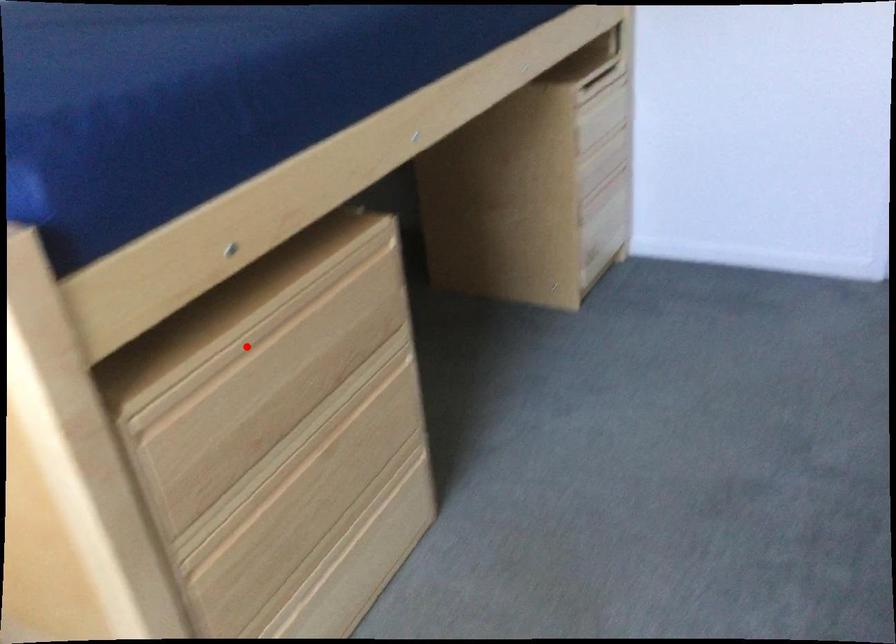
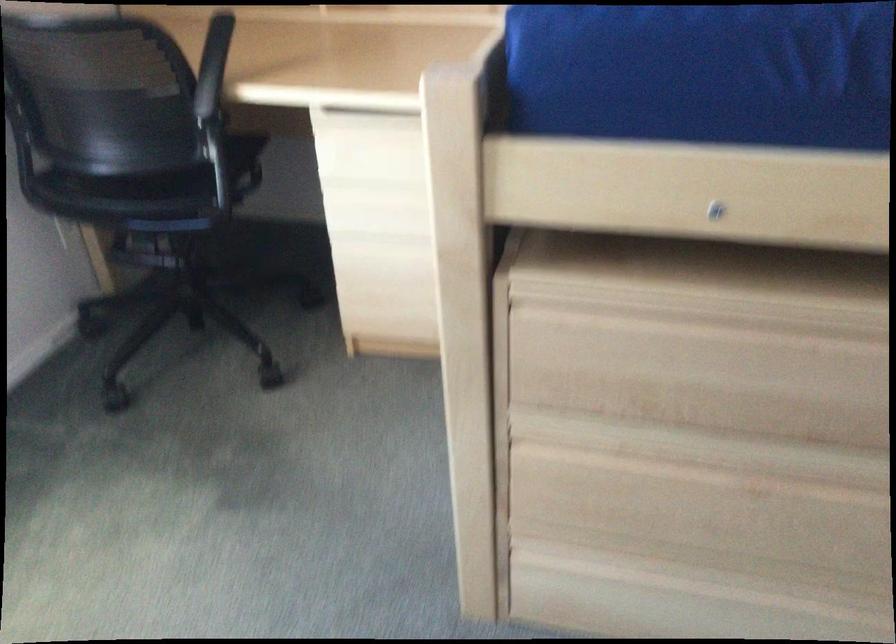
The point at the highlighted location is marked in the first image. Where is the corresponding point in the second image?

(711, 321)